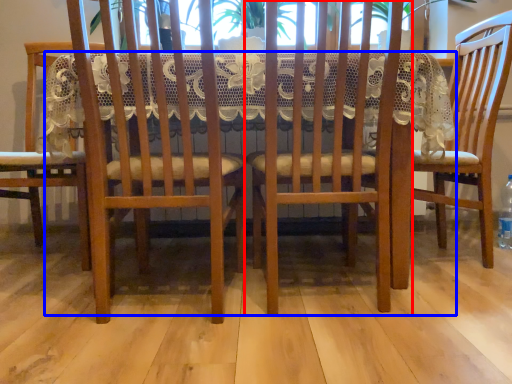
Question: Which object is closer to the camera taking this photo, chair (highlighted by a red box) or table (highlighted by a blue box)?

Choices:
 (A) chair
 (B) table

Answer: (A)